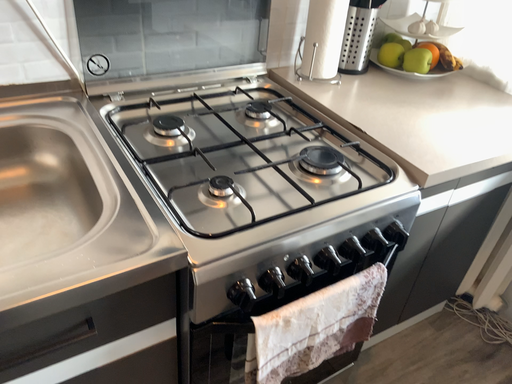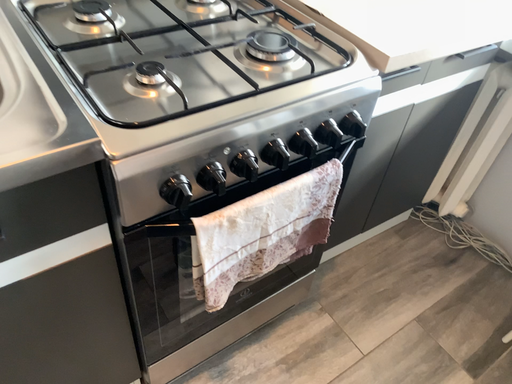
Question: Which way did the camera rotate in the video?

Choices:
 (A) rotated downward
 (B) rotated upward

Answer: (A)